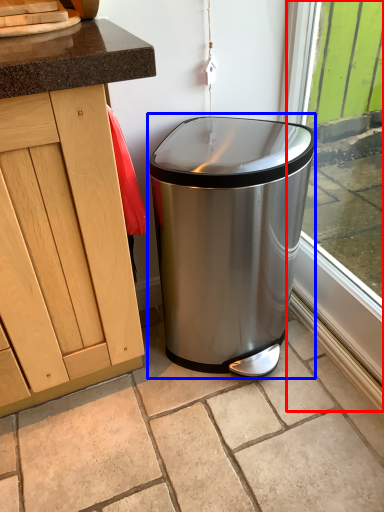
Question: Which object is further to the camera taking this photo, window frame (highlighted by a red box) or waste container (highlighted by a blue box)?

Choices:
 (A) window frame
 (B) waste container

Answer: (B)